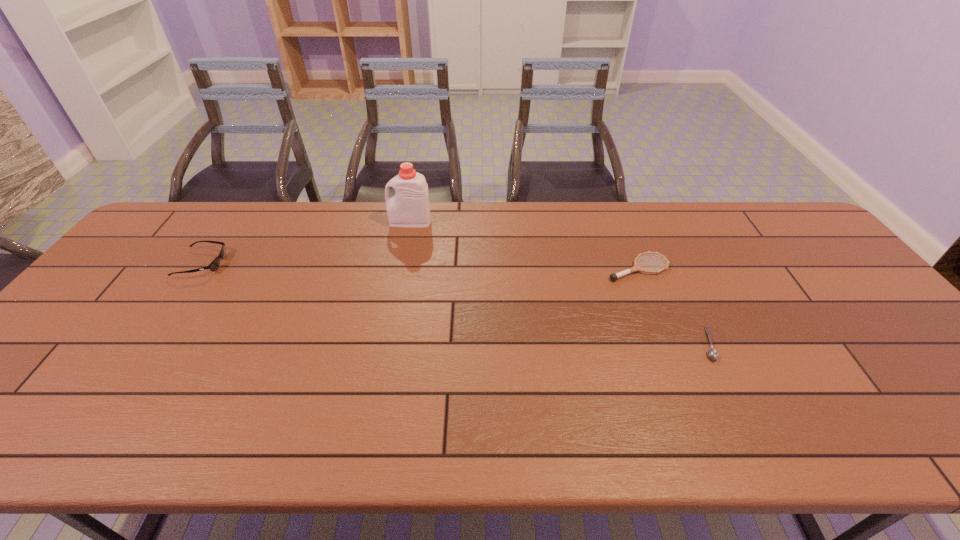
Where is `blank space located on the front-facing side of the sunglasses`? This screenshot has width=960, height=540. blank space located on the front-facing side of the sunglasses is located at coordinates (305, 264).

Where is `vacant region located 0.180m on the right of the second shortest object`? The height and width of the screenshot is (540, 960). vacant region located 0.180m on the right of the second shortest object is located at coordinates (732, 268).

I want to click on vacant area situated 0.180m on the left of the shortest object, so click(x=628, y=344).

Locate an element on the screen. This screenshot has width=960, height=540. object positioned at the far edge is located at coordinates (410, 208).

In the image, there is a desktop. Where is `vacant space at the far edge`? This screenshot has width=960, height=540. vacant space at the far edge is located at coordinates (337, 204).

Identify the location of vacant point at the near edge. This screenshot has height=540, width=960. (701, 435).

The image size is (960, 540). Find the location of `free region at the left edge of the desktop`. free region at the left edge of the desktop is located at coordinates (47, 372).

Image resolution: width=960 pixels, height=540 pixels. In order to click on free space between the leftmost object and the nearest object in this screenshot , I will do `click(455, 303)`.

Image resolution: width=960 pixels, height=540 pixels. I want to click on vacant area that lies between the sunglasses and the third object from right to left, so click(306, 242).

I want to click on unoccupied area between the second tallest object and the detergent, so click(x=306, y=242).